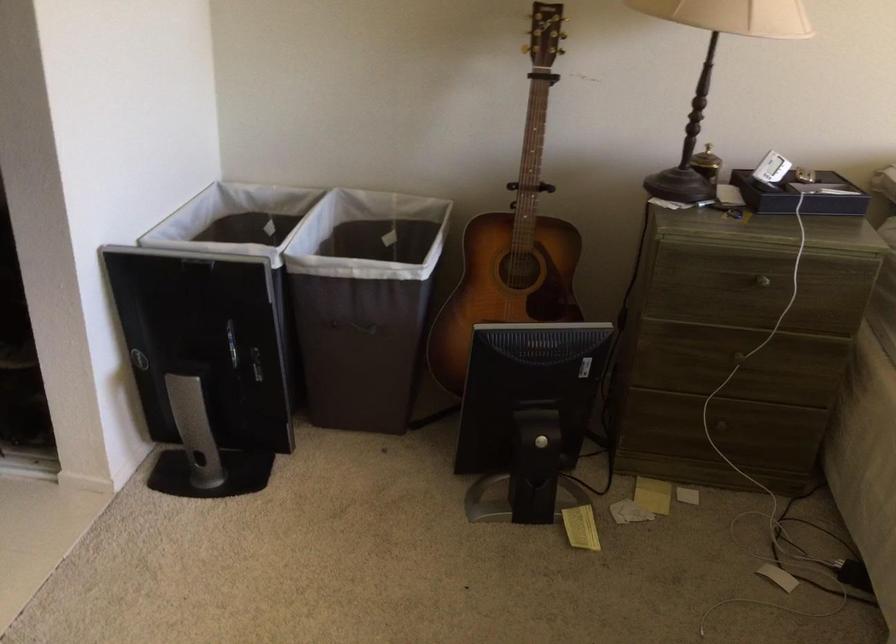
Identify the location of fabric hamper handle. (357, 327).